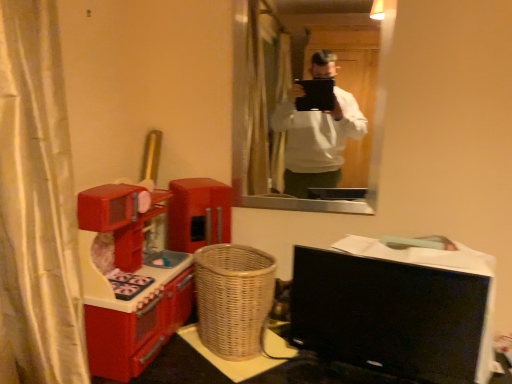
Question: Could shiny plastic toy kitchen at left be considered to be inside woven wood table at lower center?

Choices:
 (A) no
 (B) yes

Answer: (A)

Question: Can you confirm if woven wood table at lower center is bigger than shiny plastic toy kitchen at left?

Choices:
 (A) no
 (B) yes

Answer: (B)

Question: Are woven wood table at lower center and shiny plastic toy kitchen at left far apart?

Choices:
 (A) no
 (B) yes

Answer: (A)

Question: Does woven wood table at lower center appear on the left side of shiny plastic toy kitchen at left?

Choices:
 (A) yes
 (B) no

Answer: (B)

Question: Considering the relative sizes of woven wood table at lower center and shiny plastic toy kitchen at left in the image provided, is woven wood table at lower center taller than shiny plastic toy kitchen at left?

Choices:
 (A) no
 (B) yes

Answer: (A)

Question: Is matte glass mirror at upper center bigger or smaller than shiny plastic toy kitchen at left?

Choices:
 (A) big
 (B) small

Answer: (B)

Question: Is matte glass mirror at upper center spatially inside shiny plastic toy kitchen at left, or outside of it?

Choices:
 (A) inside
 (B) outside

Answer: (B)

Question: From the image's perspective, is matte glass mirror at upper center positioned above or below shiny plastic toy kitchen at left?

Choices:
 (A) above
 (B) below

Answer: (A)

Question: Is point (238, 125) closer or farther from the camera than point (172, 286)?

Choices:
 (A) farther
 (B) closer

Answer: (A)

Question: From a real-world perspective, is woven wood table at lower center positioned above or below shiny plastic toy kitchen at left?

Choices:
 (A) above
 (B) below

Answer: (B)

Question: Considering the positions of woven wood table at lower center and shiny plastic toy kitchen at left in the image, is woven wood table at lower center wider or thinner than shiny plastic toy kitchen at left?

Choices:
 (A) thin
 (B) wide

Answer: (B)

Question: Would you say woven wood table at lower center is to the left or to the right of shiny plastic toy kitchen at left in the picture?

Choices:
 (A) left
 (B) right

Answer: (B)

Question: From the image's perspective, is woven wood table at lower center above or below shiny plastic toy kitchen at left?

Choices:
 (A) above
 (B) below

Answer: (B)

Question: Looking at their shapes, would you say matte glass mirror at upper center is wider or thinner than black glossy computer monitor at lower right?

Choices:
 (A) thin
 (B) wide

Answer: (A)

Question: In the image, is matte glass mirror at upper center on the left side or the right side of black glossy computer monitor at lower right?

Choices:
 (A) left
 (B) right

Answer: (A)